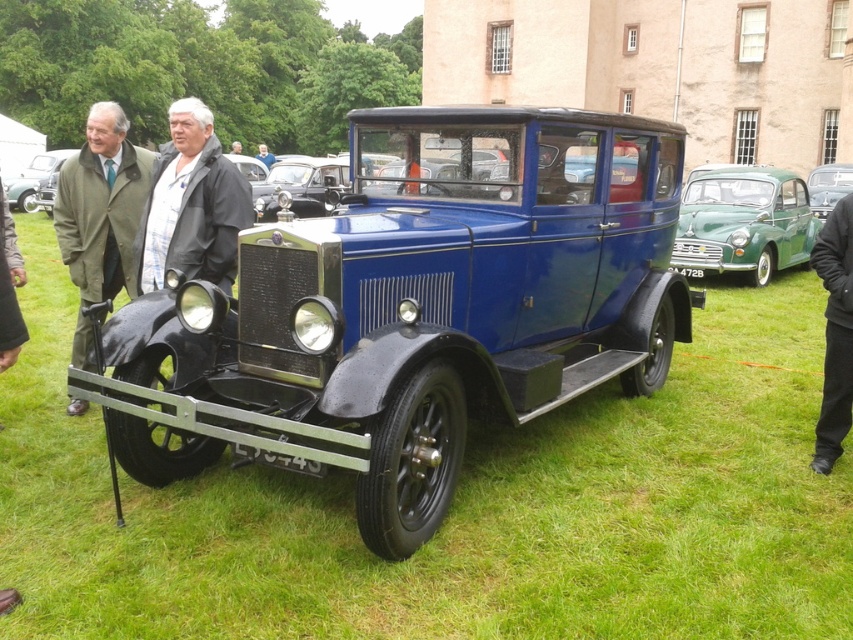
From the picture: You are a photographer planning to capture the metallic green car at center and the black fabric jacket at center in a single frame. Given that your camera has a fixed focal length, which object should you position closer to the camera to ensure both fit within the frame?

Since the black fabric jacket at center has a lesser width compared to the metallic green car at center, you should position the black fabric jacket at center closer to the camera. This way, its apparent size will increase, balancing the sizes of both objects within the frame.

You are standing at the front of the vintage car and looking towards the stepboard. There is a point marked at coordinates (192, 204). What object is located at that point?

The point at coordinates (192, 204) corresponds to the black fabric jacket at center.

You are a fashion designer observing the vintage car display and notice two items in the scene. Which item is thinner between the black cotton pants at lower right and the light blue fabric jacket at center?

The black cotton pants at lower right is thinner than the light blue fabric jacket at center.